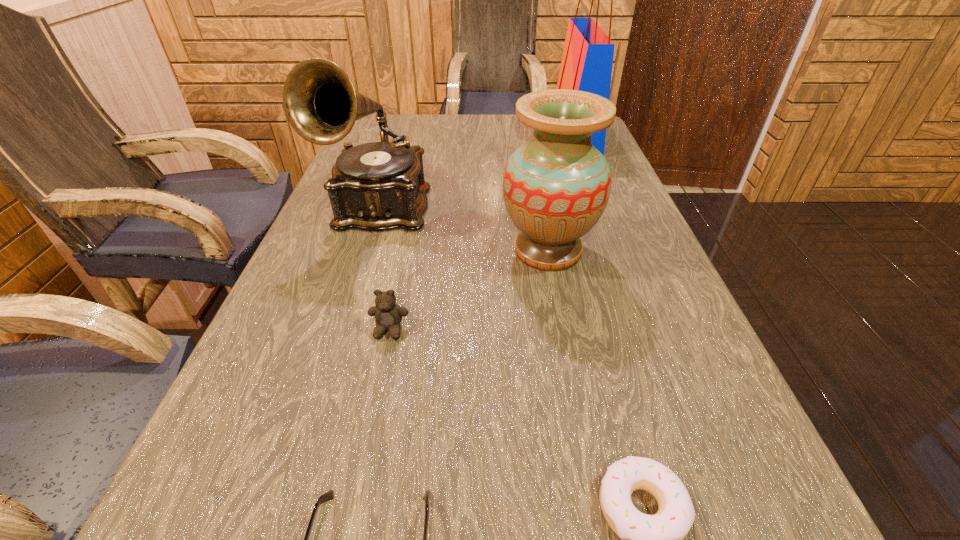
Where is `vacant area between the phonograph record and the tallest object`? vacant area between the phonograph record and the tallest object is located at coordinates (477, 172).

This screenshot has height=540, width=960. In order to click on vacant space that is in between the vase and the phonograph record in this screenshot , I will do `click(464, 230)`.

Where is `the closest object to the shopping bag`? the closest object to the shopping bag is located at coordinates (556, 186).

This screenshot has width=960, height=540. I want to click on object that stands as the fourth closest to the teddy bear, so click(657, 539).

I want to click on vacant area that satisfies the following two spatial constraints: 1. on the horn of the phonograph record; 2. on the right side of the fourth shortest object, so click(x=366, y=251).